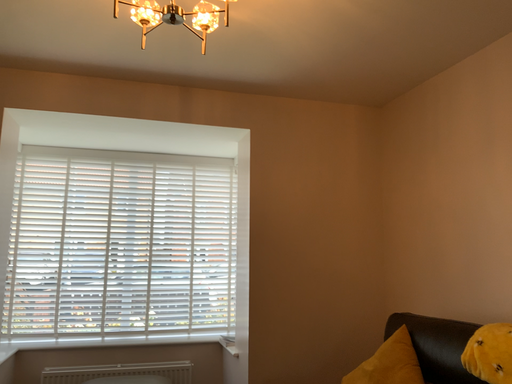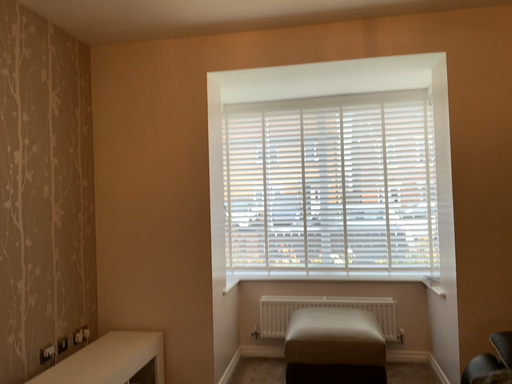
Question: How did the camera likely rotate when shooting the video?

Choices:
 (A) rotated right
 (B) rotated left

Answer: (B)